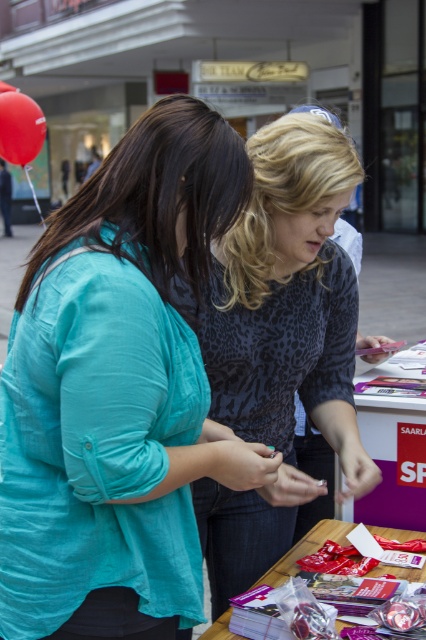
How much distance is there between leopard print blouse at center and matte plastic table at center?

18.31 inches

Is leopard print blouse at center positioned in front of matte plastic table at center?

Yes.

Identify the location of leopard print blouse at center. The width and height of the screenshot is (426, 640). (287, 298).

Looking at this image, is the position of matte plastic table at center more distant than that of matte plastic table at lower center?

Yes, matte plastic table at center is behind matte plastic table at lower center.

Is point (339, 474) in front of point (408, 573)?

No, it is behind (408, 573).

Locate an element on the screen. matte plastic table at center is located at coordinates (391, 451).

Describe the element at coordinates (118, 388) in the screenshot. I see `teal fabric shirt at center` at that location.

Can you confirm if teal fabric shirt at center is positioned below matte plastic table at lower center?

Actually, teal fabric shirt at center is above matte plastic table at lower center.

At what (x,y) coordinates should I click in order to perform the action: click on teal fabric shirt at center. Please return your answer as a coordinate pair (x, y). Image resolution: width=426 pixels, height=640 pixels. Looking at the image, I should click on (x=118, y=388).

Where is `teal fabric shirt at center`? teal fabric shirt at center is located at coordinates (118, 388).